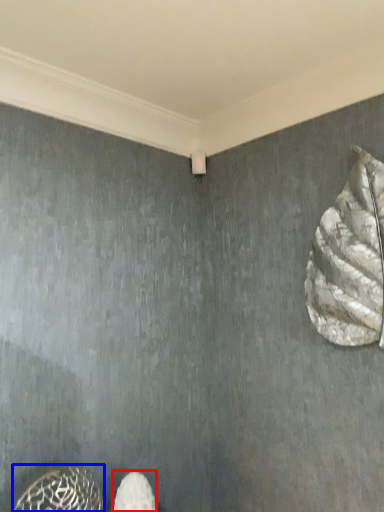
Question: Which point is further to the camera, footwear (highlighted by a red box) or animal (highlighted by a blue box)?

Choices:
 (A) footwear
 (B) animal

Answer: (A)